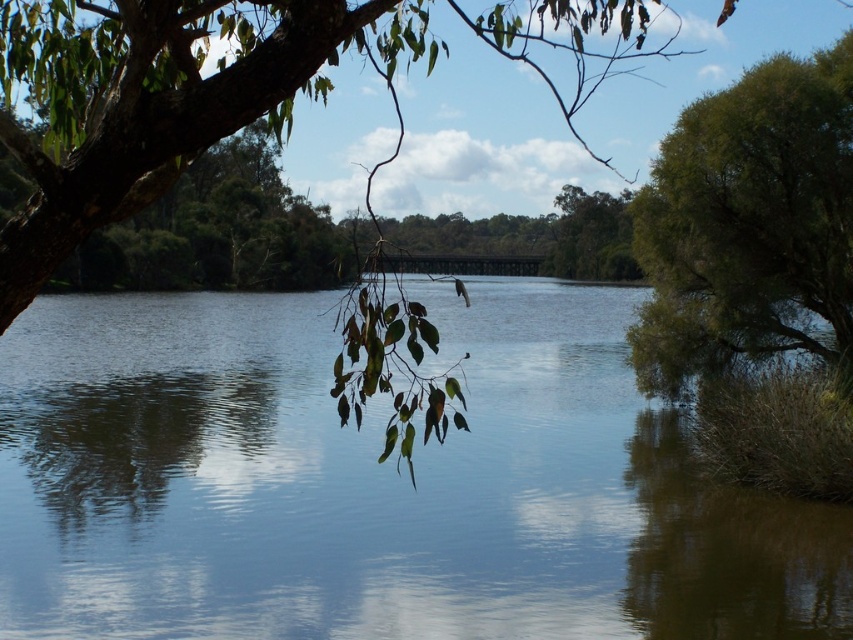
Which is more to the left, green leafy branch at upper left or green leafy bush at right?

From the viewer's perspective, green leafy branch at upper left appears more on the left side.

Can you confirm if green leafy branch at upper left is positioned above green leafy bush at right?

Indeed, green leafy branch at upper left is positioned over green leafy bush at right.

Locate an element on the screen. green leafy branch at upper left is located at coordinates (161, 99).

At what (x,y) coordinates should I click in order to perform the action: click on green leafy branch at upper left. Please return your answer as a coordinate pair (x, y). Looking at the image, I should click on (161, 99).

Does clear water at center lie behind green leafy bush at right?

No, clear water at center is in front of green leafy bush at right.

Where is `clear water at center`? The image size is (853, 640). clear water at center is located at coordinates (376, 484).

Can you confirm if clear water at center is smaller than green leafy branch at upper left?

Correct, clear water at center occupies less space than green leafy branch at upper left.

Can you confirm if clear water at center is bigger than green leafy branch at upper left?

No.

Describe the element at coordinates (376, 484) in the screenshot. This screenshot has height=640, width=853. I see `clear water at center` at that location.

Locate an element on the screen. clear water at center is located at coordinates (376, 484).